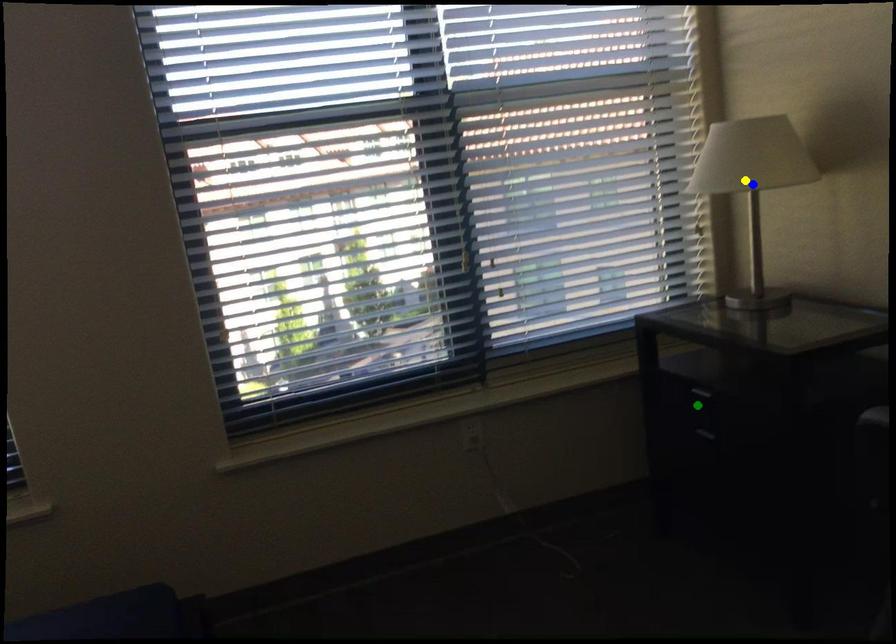
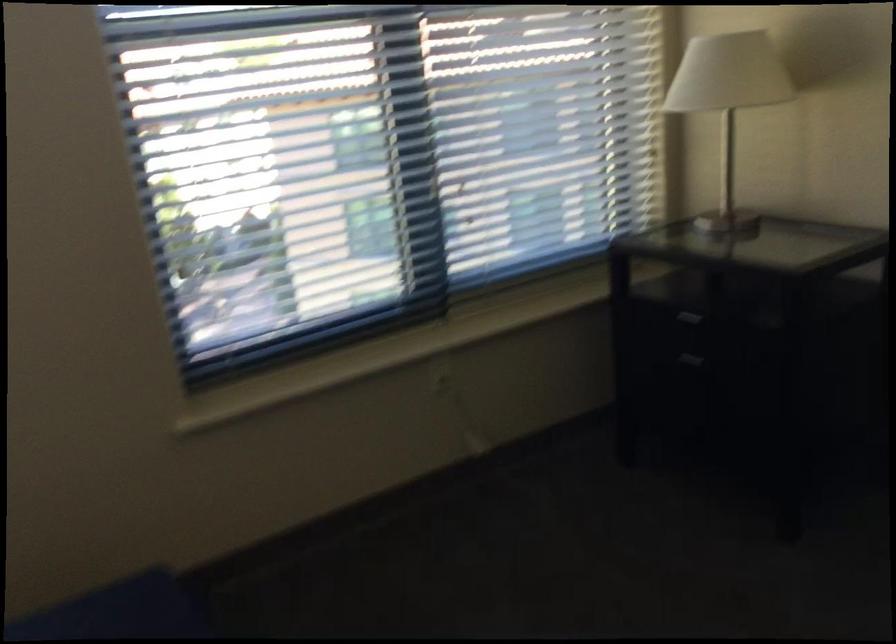
I am providing you with two images of the same scene from different viewpoints. Three points are marked in image1. Which point corresponds to a part or object that is occluded in image2?In image1, three points are marked. Which of them correspond to a part or object that is occluded in image2?Among the three points shown in image1, which one corresponds to a part or object that is no longer visible due to occlusion in image2?

blue point cannot be seen in image2.